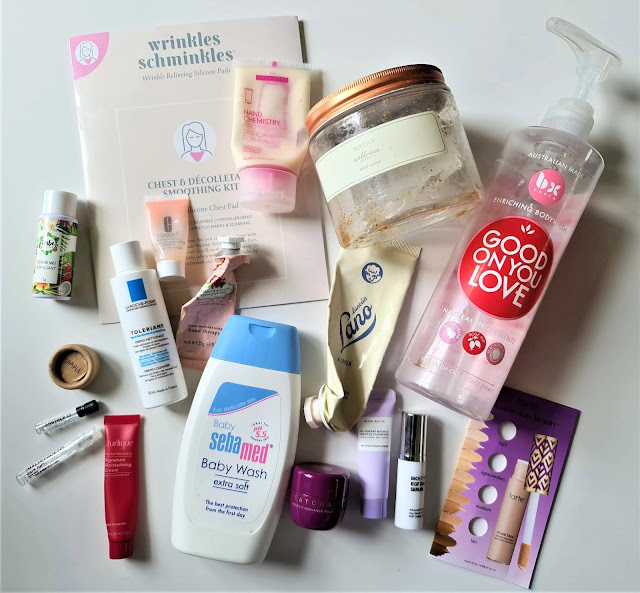
At what (x,y) coordinates should I click in order to perform the action: click on jar. Please return your answer as a coordinate pair (x, y). This screenshot has width=640, height=593. Looking at the image, I should click on (417, 181).